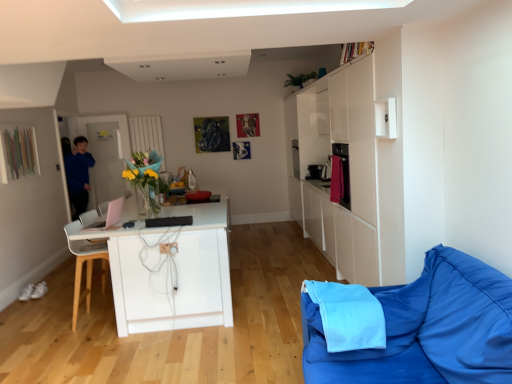
Question: Which direction should I rotate to face pink plastic laptop at center, placed as the second appliance when sorted from front to back, — up or down?

Choices:
 (A) up
 (B) down

Answer: (B)

Question: Should I look upward or downward to see blue fabric at lower right?

Choices:
 (A) down
 (B) up

Answer: (A)

Question: Is blue fabric at lower right aimed at black matte speaker at center, which is the 1th appliance from front to back?

Choices:
 (A) yes
 (B) no

Answer: (B)

Question: Does blue fabric at lower right appear on the right side of black matte speaker at center, which is the 2th appliance from left to right?

Choices:
 (A) no
 (B) yes

Answer: (B)

Question: Is blue fabric at lower right placed right next to black matte speaker at center, which is the 2th appliance from left to right?

Choices:
 (A) no
 (B) yes

Answer: (A)

Question: Does blue fabric at lower right appear on the left side of black matte speaker at center, the first appliance in the right-to-left sequence?

Choices:
 (A) no
 (B) yes

Answer: (A)

Question: Considering the relative sizes of blue fabric at lower right and black matte speaker at center, which is the 2th appliance from left to right, in the image provided, is blue fabric at lower right taller than black matte speaker at center, which is the 2th appliance from left to right,?

Choices:
 (A) yes
 (B) no

Answer: (A)

Question: Can you confirm if blue fabric at lower right is bigger than black matte speaker at center, which is the 2th appliance from left to right?

Choices:
 (A) yes
 (B) no

Answer: (A)

Question: Does blue fabric couch at lower right have a larger size compared to blue fabric at lower right?

Choices:
 (A) no
 (B) yes

Answer: (B)

Question: From a real-world perspective, is blue fabric couch at lower right located beneath blue fabric at lower right?

Choices:
 (A) no
 (B) yes

Answer: (B)

Question: Can you confirm if blue fabric couch at lower right is shorter than blue fabric at lower right?

Choices:
 (A) yes
 (B) no

Answer: (B)

Question: Is blue fabric couch at lower right at the left side of blue fabric at lower right?

Choices:
 (A) yes
 (B) no

Answer: (B)

Question: Would you say blue fabric at lower right is part of blue fabric couch at lower right's contents?

Choices:
 (A) no
 (B) yes

Answer: (B)

Question: Could you tell me if blue fabric couch at lower right is facing blue fabric at lower right?

Choices:
 (A) yes
 (B) no

Answer: (A)

Question: From a real-world perspective, does blue fabric couch at lower right stand above pink plastic laptop at center, acting as the second appliance starting from the right?

Choices:
 (A) yes
 (B) no

Answer: (B)